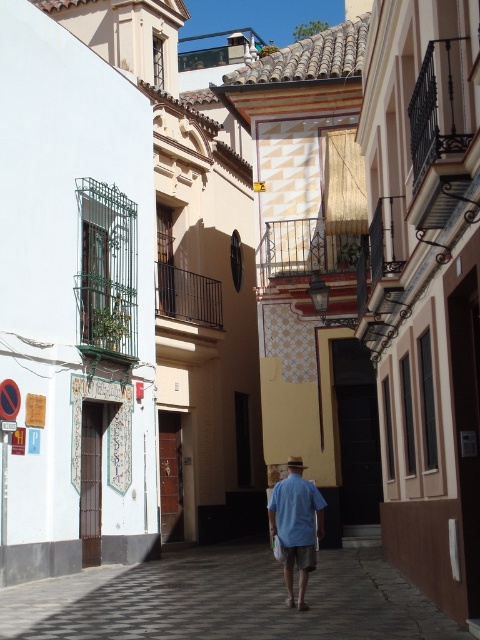
Question: Which point is farther to the camera?

Choices:
 (A) checkerboard tile pavement at center
 (B) blue cotton shirt at center

Answer: (B)

Question: Which point is farther to the camera?

Choices:
 (A) blue cotton shirt at center
 (B) checkerboard tile pavement at center

Answer: (A)

Question: Is checkerboard tile pavement at center behind blue cotton shirt at center?

Choices:
 (A) yes
 (B) no

Answer: (B)

Question: Observing the image, what is the correct spatial positioning of checkerboard tile pavement at center in reference to blue cotton shirt at center?

Choices:
 (A) right
 (B) left

Answer: (B)

Question: Does checkerboard tile pavement at center appear on the right side of blue cotton shirt at center?

Choices:
 (A) yes
 (B) no

Answer: (B)